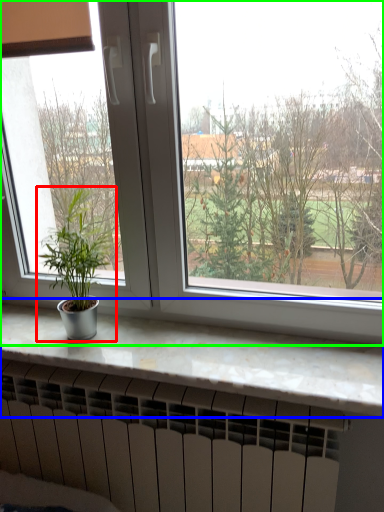
Question: Estimate the real-world distances between objects in this image. Which object is closer to houseplant (highlighted by a red box), counter top (highlighted by a blue box) or window (highlighted by a green box)?

Choices:
 (A) counter top
 (B) window

Answer: (B)